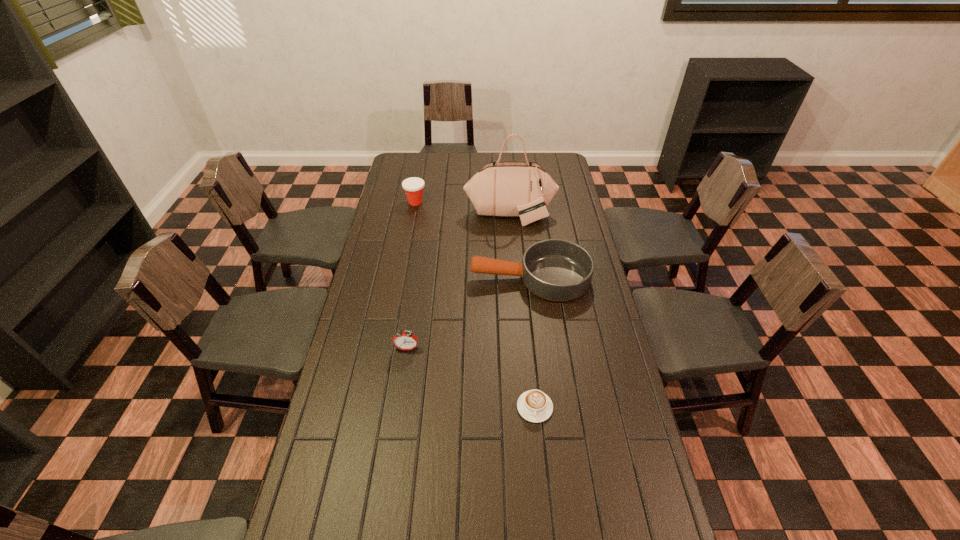
Image resolution: width=960 pixels, height=540 pixels. Identify the location of free space between the cappuccino and the tallest object. (522, 311).

Image resolution: width=960 pixels, height=540 pixels. I want to click on free space between the Dixie cup and the fourth farthest object, so click(411, 275).

Locate an element on the screen. vacant point located between the pan and the Dixie cup is located at coordinates (473, 240).

I want to click on free space between the Dixie cup and the shortest object, so click(475, 305).

This screenshot has height=540, width=960. I want to click on free spot between the Dixie cup and the second nearest object, so click(411, 275).

Where is `vacant region between the shortest object and the second nearest object`? The image size is (960, 540). vacant region between the shortest object and the second nearest object is located at coordinates (470, 377).

The width and height of the screenshot is (960, 540). I want to click on empty location between the fourth farthest object and the third farthest object, so click(x=468, y=313).

The image size is (960, 540). Find the location of `empty space that is in between the alarm clock and the cappuccino`. empty space that is in between the alarm clock and the cappuccino is located at coordinates (470, 377).

Find the location of a particular element. empty space that is in between the alarm clock and the tallest object is located at coordinates (459, 281).

Locate an element on the screen. This screenshot has height=540, width=960. free space between the handbag and the cappuccino is located at coordinates (522, 311).